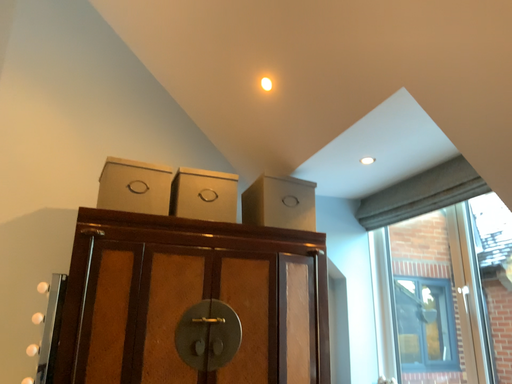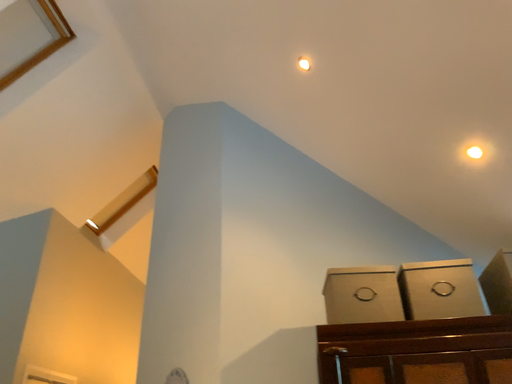
Question: How did the camera likely rotate when shooting the video?

Choices:
 (A) rotated downward
 (B) rotated upward

Answer: (B)